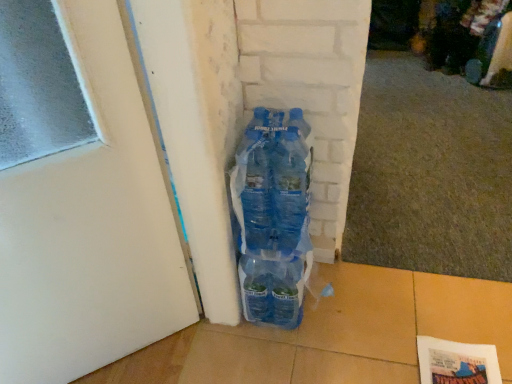
In order to face white matte door at center, should I rotate leftwards or rightwards?

Rotate left and turn 9.791 degrees.

The height and width of the screenshot is (384, 512). Describe the element at coordinates (79, 198) in the screenshot. I see `white matte door at center` at that location.

Locate an element on the screen. Image resolution: width=512 pixels, height=384 pixels. white matte door at center is located at coordinates (79, 198).

What do you see at coordinates (274, 216) in the screenshot? This screenshot has height=384, width=512. I see `translucent plastic bottles at center` at bounding box center [274, 216].

Locate an element on the screen. The width and height of the screenshot is (512, 384). translucent plastic bottles at center is located at coordinates [274, 216].

What is the approximate width of translucent plastic bottles at center?

It is 8.02 inches.

Where is `white matte door at center`? Image resolution: width=512 pixels, height=384 pixels. white matte door at center is located at coordinates (79, 198).

Can you confirm if translucent plastic bottles at center is positioned to the left of white matte door at center?

No.

Is translucent plastic bottles at center closer to the viewer compared to white matte door at center?

No, it is behind white matte door at center.

Between point (243, 174) and point (19, 217), which one is positioned in front?

The point (19, 217) is more forward.

From the image's perspective, which is below, translucent plastic bottles at center or white matte door at center?

white matte door at center is shown below in the image.

From a real-world perspective, relative to white matte door at center, is translucent plastic bottles at center vertically above or below?

From a real-world perspective, translucent plastic bottles at center is physically below white matte door at center.

Considering the relative sizes of translucent plastic bottles at center and white matte door at center in the image provided, is translucent plastic bottles at center wider than white matte door at center?

Indeed, translucent plastic bottles at center has a greater width compared to white matte door at center.

Between translucent plastic bottles at center and white matte door at center, which one has less height?

translucent plastic bottles at center is shorter.

Considering the sizes of translucent plastic bottles at center and white matte door at center in the image, is translucent plastic bottles at center bigger or smaller than white matte door at center?

translucent plastic bottles at center is smaller than white matte door at center.

Would you say translucent plastic bottles at center contains white matte door at center?

No.

Is translucent plastic bottles at center far away from white matte door at center?

No, there isn't a large distance between translucent plastic bottles at center and white matte door at center.

Is white matte door at center at the back of translucent plastic bottles at center?

No, white matte door at center is not at the back of translucent plastic bottles at center.

Can you tell me how much translucent plastic bottles at center and white matte door at center differ in facing direction?

There is a 2.5-degree angle between the facing directions of translucent plastic bottles at center and white matte door at center.

Find the location of a particular element. The image size is (512, 384). door in front of the translucent plastic bottles at center is located at coordinates (79, 198).

Considering the positions of objects white matte door at center and translucent plastic bottles at center in the image provided, who is more to the left, white matte door at center or translucent plastic bottles at center?

white matte door at center.

Relative to translucent plastic bottles at center, is white matte door at center in front or behind?

Visually, white matte door at center is located in front of translucent plastic bottles at center.

Is point (118, 296) positioned before point (273, 139)?

No, (118, 296) is behind (273, 139).

From the image's perspective, relative to translucent plastic bottles at center, is white matte door at center above or below?

Based on their image positions, white matte door at center is located beneath translucent plastic bottles at center.

From a real-world perspective, is white matte door at center located higher than translucent plastic bottles at center?

Yes, from a real-world perspective, white matte door at center is on top of translucent plastic bottles at center.

Considering the relative sizes of white matte door at center and translucent plastic bottles at center in the image provided, is white matte door at center wider than translucent plastic bottles at center?

No.

Who is shorter, white matte door at center or translucent plastic bottles at center?

With less height is translucent plastic bottles at center.

Based on their sizes in the image, would you say white matte door at center is bigger or smaller than translucent plastic bottles at center?

In the image, white matte door at center appears to be larger than translucent plastic bottles at center.

Is white matte door at center inside or outside of translucent plastic bottles at center?

white matte door at center is located beyond the bounds of translucent plastic bottles at center.

Are white matte door at center and translucent plastic bottles at center making contact?

There is a gap between white matte door at center and translucent plastic bottles at center.

Is white matte door at center oriented towards translucent plastic bottles at center?

No, white matte door at center is not aimed at translucent plastic bottles at center.

Measure the distance from white matte door at center to translucent plastic bottles at center.

white matte door at center and translucent plastic bottles at center are 12.89 inches apart.

Where is `door lying below the translucent plastic bottles at center (from the image's perspective)`? The height and width of the screenshot is (384, 512). door lying below the translucent plastic bottles at center (from the image's perspective) is located at coordinates (79, 198).

Where is `bottle below the white matte door at center (from a real-world perspective)`? The image size is (512, 384). bottle below the white matte door at center (from a real-world perspective) is located at coordinates [274, 216].

This screenshot has width=512, height=384. I want to click on door lying on the left of translucent plastic bottles at center, so click(79, 198).